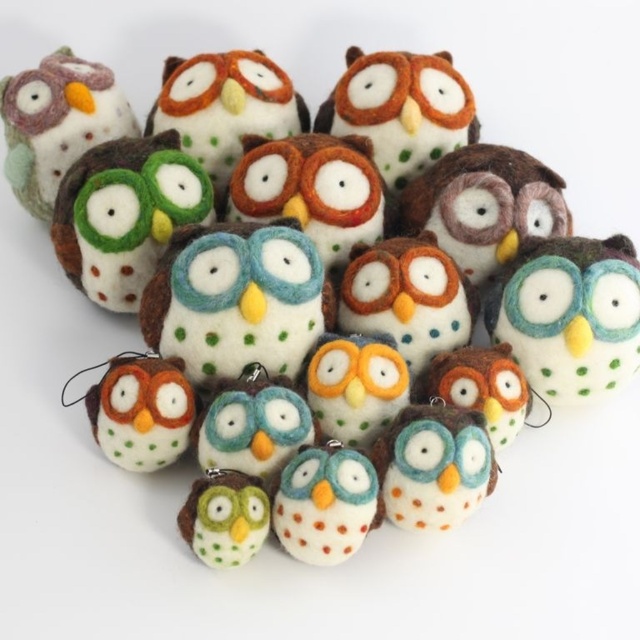
You are looking at the handmade felted owl ornaments arranged in a loose cluster. There are two points marked on the image, point A at coordinates point (636, 353) and point B at coordinates point (22, 144). Which point is closer to you?

Point point (636, 353) is closer to the camera than point point (22, 144).

You are organizing a display of handmade felted owl ornaments. You have two owls to place on a shelf. The matte felt owl at center and the matte felt owl at upper left. Which owl should you choose if you want to place a taller ornament on the shelf?

The matte felt owl at upper left is taller than the matte felt owl at center, so you should choose the matte felt owl at upper left to place on the shelf if you want a taller ornament.

You are an interior designer arranging these felted owl ornaments. You need to place a new small decoration between the matte felt owl at center and the matte felt owl at upper left. Based on their positions, where should you place the new decoration?

The new decoration should be placed between the matte felt owl at center and the matte felt owl at upper left, positioned below the matte felt owl at upper left and above the matte felt owl at center since the center owl is located below the upper left one.